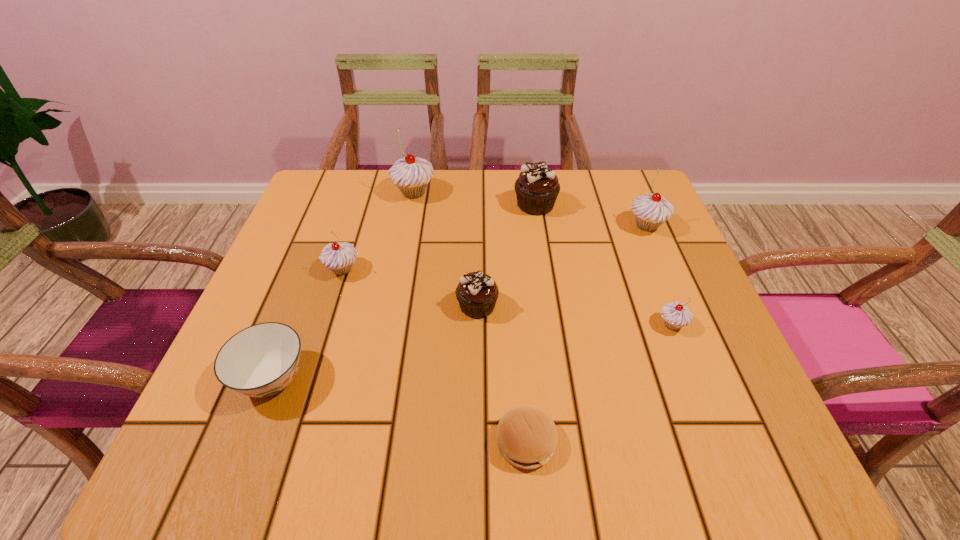
Where is `the smaller brown cupcake`? This screenshot has width=960, height=540. the smaller brown cupcake is located at coordinates (477, 293).

Where is `the second shortest object`? This screenshot has height=540, width=960. the second shortest object is located at coordinates pyautogui.click(x=261, y=360).

This screenshot has width=960, height=540. I want to click on the shortest object, so click(527, 437).

Find the location of `free spot located on the front of the biggest gray cupcake`. free spot located on the front of the biggest gray cupcake is located at coordinates (398, 274).

Locate an element on the screen. vacant space located on the left of the second farthest gray cupcake is located at coordinates (520, 226).

Find the location of `free space located on the left of the bigger brown cupcake`. free space located on the left of the bigger brown cupcake is located at coordinates (386, 205).

Identify the location of vacant space located 0.390m on the front of the third nearest cupcake. (280, 467).

The width and height of the screenshot is (960, 540). I want to click on vacant point located 0.340m on the left of the smallest gray cupcake, so click(x=483, y=325).

Locate an element on the screen. The width and height of the screenshot is (960, 540). vacant space situated 0.240m on the back of the left brown cupcake is located at coordinates (478, 220).

Identify the location of free space located 0.110m on the back of the second shortest object. Image resolution: width=960 pixels, height=540 pixels. (301, 303).